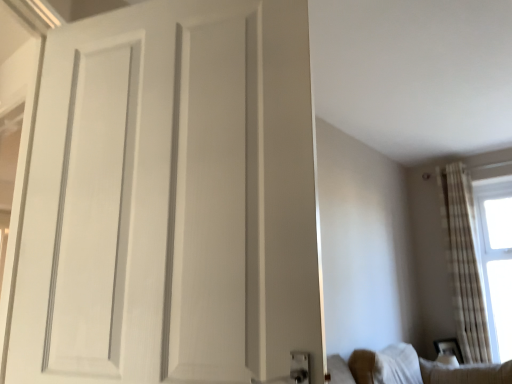
Question: Relative to white sheer curtain at right, is white fabric couch at lower right in front or behind?

Choices:
 (A) behind
 (B) front

Answer: (B)

Question: Do you think white fabric couch at lower right is within white sheer curtain at right, or outside of it?

Choices:
 (A) inside
 (B) outside

Answer: (B)

Question: Which of these objects is positioned closest to the white fabric couch at lower right?

Choices:
 (A) white matte door at center
 (B) white sheer curtain at right
 (C) white sheer curtains at right

Answer: (C)

Question: Which is farther from the white matte door at center?

Choices:
 (A) white sheer curtain at right
 (B) white sheer curtains at right
 (C) white fabric couch at lower right

Answer: (A)